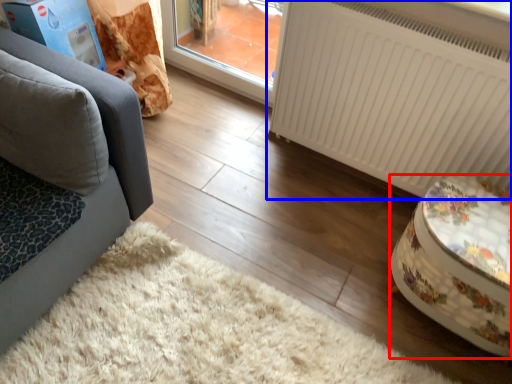
Question: Which object is closer to the camera taking this photo, furniture (highlighted by a red box) or radiator (highlighted by a blue box)?

Choices:
 (A) furniture
 (B) radiator

Answer: (A)